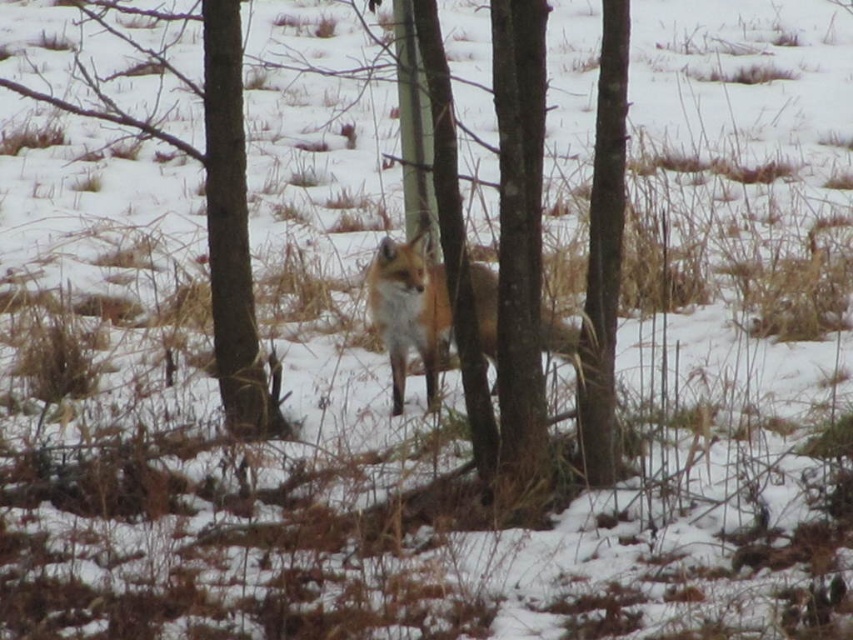
Is smooth bark tree at center above smooth bark tree at right?

No.

Who is positioned more to the right, smooth bark tree at center or smooth bark tree at right?

smooth bark tree at right is more to the right.

Who is more distant from viewer, (515,93) or (606,3)?

The point (606,3) is more distant.

This screenshot has width=853, height=640. I want to click on smooth bark tree at center, so click(519, 234).

Who is taller, smooth bark tree at center or fluffy reddish-brown fox at center?

smooth bark tree at center is taller.

Is smooth bark tree at center smaller than fluffy reddish-brown fox at center?

Correct, smooth bark tree at center occupies less space than fluffy reddish-brown fox at center.

Does point (502, 65) lie behind point (403, 320)?

No, it is in front of (403, 320).

Where is `smooth bark tree at center`? The width and height of the screenshot is (853, 640). smooth bark tree at center is located at coordinates pos(519,234).

How much distance is there between smooth bark tree at right and fluffy reddish-brown fox at center?

smooth bark tree at right and fluffy reddish-brown fox at center are 1.16 meters apart from each other.

Can you confirm if smooth bark tree at right is taller than fluffy reddish-brown fox at center?

Correct, smooth bark tree at right is much taller as fluffy reddish-brown fox at center.

Between point (596, 212) and point (387, 253), which one is positioned in front?

Positioned in front is point (596, 212).

Where is `smooth bark tree at right`? The image size is (853, 640). smooth bark tree at right is located at coordinates (604, 250).